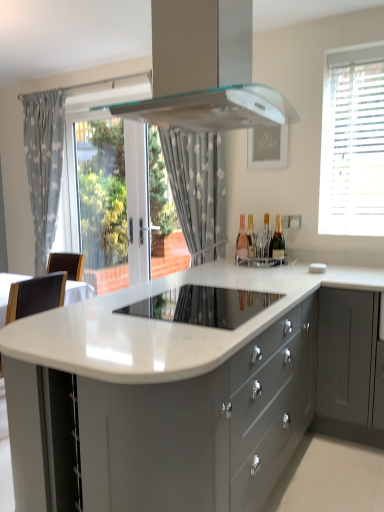
Question: From the image's perspective, is black leather chair at left below high-gloss white cooktop at center?

Choices:
 (A) no
 (B) yes

Answer: (B)

Question: Considering the relative positions of black leather chair at left and high-gloss white cooktop at center in the image provided, is black leather chair at left to the left of high-gloss white cooktop at center from the viewer's perspective?

Choices:
 (A) no
 (B) yes

Answer: (B)

Question: Can you confirm if black leather chair at left is taller than high-gloss white cooktop at center?

Choices:
 (A) no
 (B) yes

Answer: (B)

Question: Can you confirm if black leather chair at left is wider than high-gloss white cooktop at center?

Choices:
 (A) yes
 (B) no

Answer: (B)

Question: Would you say high-gloss white cooktop at center is part of black leather chair at left's contents?

Choices:
 (A) no
 (B) yes

Answer: (A)

Question: Would you say white dotted fabric at center, which ranks as the 2th curtain in left-to-right order, is inside or outside matte glass wine bottle at center, marked as the third wine bottle in a right-to-left arrangement?

Choices:
 (A) outside
 (B) inside

Answer: (A)

Question: Considering the positions of white dotted fabric at center, which ranks as the 1th curtain in front-to-back order, and matte glass wine bottle at center, marked as the third wine bottle in a right-to-left arrangement, in the image, is white dotted fabric at center, which ranks as the 1th curtain in front-to-back order, wider or thinner than matte glass wine bottle at center, marked as the third wine bottle in a right-to-left arrangement,?

Choices:
 (A) thin
 (B) wide

Answer: (B)

Question: Is white dotted fabric at center, which ranks as the 2th curtain in left-to-right order, to the left or to the right of matte glass wine bottle at center, marked as the third wine bottle in a right-to-left arrangement, in the image?

Choices:
 (A) left
 (B) right

Answer: (A)

Question: Is white dotted fabric at center, which ranks as the 2th curtain in left-to-right order, bigger or smaller than matte glass wine bottle at center, the 1th wine bottle positioned from the left?

Choices:
 (A) small
 (B) big

Answer: (B)

Question: Considering the positions of transparent glass door at left and transparent glass door at center in the image, is transparent glass door at left bigger or smaller than transparent glass door at center?

Choices:
 (A) big
 (B) small

Answer: (B)

Question: Considering their positions, is transparent glass door at left located in front of or behind transparent glass door at center?

Choices:
 (A) front
 (B) behind

Answer: (B)

Question: Is transparent glass door at left to the left or to the right of transparent glass door at center in the image?

Choices:
 (A) left
 (B) right

Answer: (A)

Question: Does point (82, 216) appear closer or farther from the camera than point (160, 204)?

Choices:
 (A) farther
 (B) closer

Answer: (A)

Question: Which is correct: matte gold wine bottle at center, arranged as the 2th wine bottle when viewed from the left, is inside gray fabric curtain at left, arranged as the 2th curtain when viewed from the right, or outside of it?

Choices:
 (A) outside
 (B) inside

Answer: (A)

Question: From a real-world perspective, is matte gold wine bottle at center, which is counted as the second wine bottle, starting from the right, positioned above or below gray fabric curtain at left, the 2th curtain positioned from the front?

Choices:
 (A) below
 (B) above

Answer: (A)